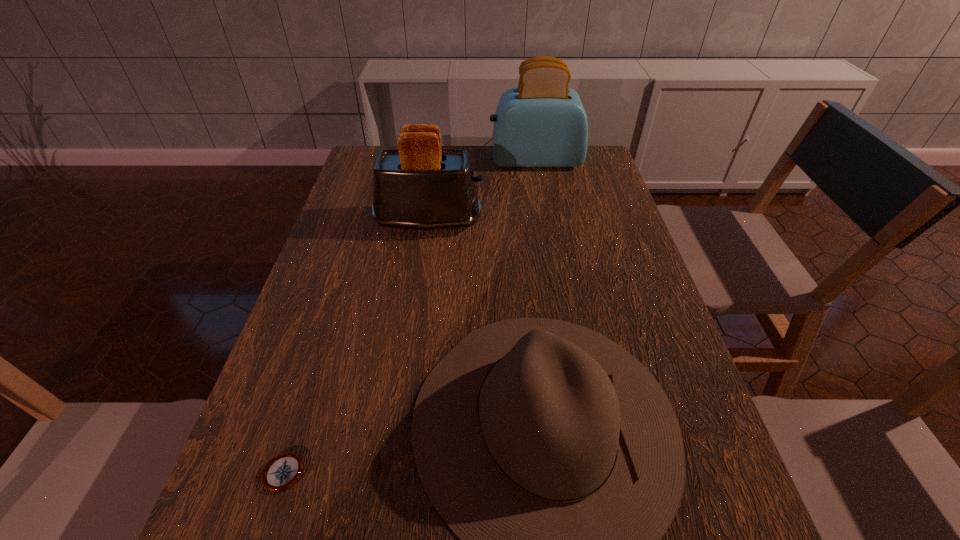
At what (x,y) coordinates should I click in order to perform the action: click on object that is at the far edge. Please return your answer as a coordinate pair (x, y). The width and height of the screenshot is (960, 540). Looking at the image, I should click on (541, 123).

Locate an element on the screen. The image size is (960, 540). toaster that is at the left edge is located at coordinates (421, 186).

At what (x,y) coordinates should I click in order to perform the action: click on compass that is at the left edge. Please return your answer as a coordinate pair (x, y). This screenshot has height=540, width=960. Looking at the image, I should click on (283, 471).

This screenshot has height=540, width=960. I want to click on object at the right edge, so click(541, 123).

Identify the location of object present at the far right corner. [x=541, y=123].

You are a GUI agent. You are given a task and a screenshot of the screen. Output one action in this format:
    pyautogui.click(x=<x>, y=<y>)
    Task: Click on the free space at the far edge of the desktop
    This screenshot has width=960, height=540.
    Given the screenshot: What is the action you would take?
    pyautogui.click(x=545, y=171)

Where is `vacant space at the left edge of the desktop`? This screenshot has height=540, width=960. vacant space at the left edge of the desktop is located at coordinates (303, 426).

The height and width of the screenshot is (540, 960). Find the location of `vacant space at the right edge`. vacant space at the right edge is located at coordinates (710, 452).

At what (x,y) coordinates should I click in order to perform the action: click on free space at the far right corner. Please return your answer as a coordinate pair (x, y). Looking at the image, I should click on (599, 172).

Where is `free space between the compass and the farthest object`? This screenshot has width=960, height=540. free space between the compass and the farthest object is located at coordinates (408, 317).